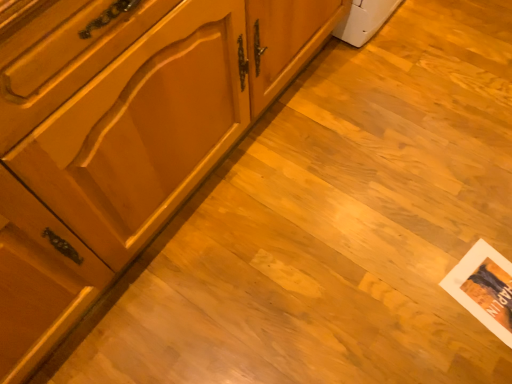
What is the approximate width of matte wood cabinet at center?

matte wood cabinet at center is 24.77 inches wide.

Measure the distance between point (249, 111) and camera.

A distance of 4.31 feet exists between point (249, 111) and camera.

The width and height of the screenshot is (512, 384). Identify the location of matte wood cabinet at center. (139, 110).

In order to face matte wood cabinet at center, should I rotate leftwards or rightwards?

Turn left approximately 17.790 degrees to face it.

Describe the element at coordinates (139, 110) in the screenshot. I see `matte wood cabinet at center` at that location.

This screenshot has width=512, height=384. What are the coordinates of `matte wood cabinet at center` in the screenshot? It's located at (139, 110).